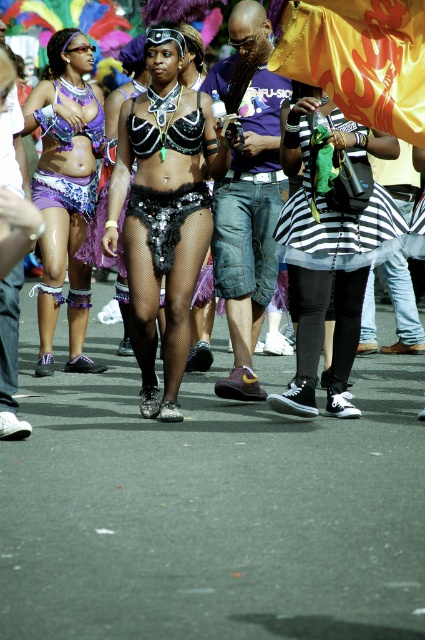
You are a photographer standing 2 meters away from the scene. You want to capture a closeup shot of the black sequined bikini top at center and the striped fabric skirt at center in the same frame. Can you do this without moving your camera? Explain why or why not.

The black sequined bikini top at center is 1.04 meters away from the striped fabric skirt at center. Since you are already 2 meters away from the scene, the distance between the two objects is within your camera frame, so yes, you can capture both in the same frame without moving the camera.

You are a photographer at the parade. You want to capture a photo of the striped fabric skirt at center and the shiny sequined costume at center. Which one will appear narrower in the photo?

The striped fabric skirt at center is thinner than the shiny sequined costume at center, so it will appear narrower in the photo.